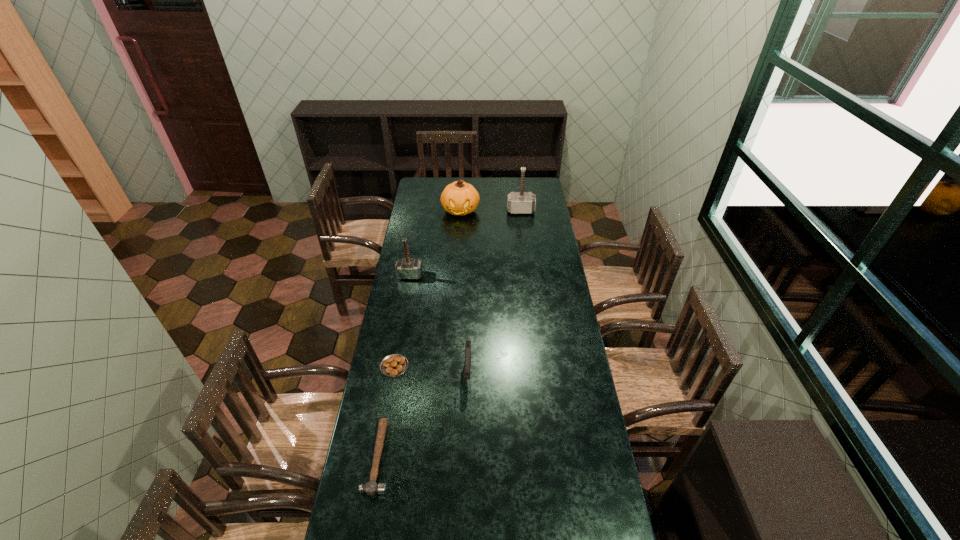
What are the coordinates of `the rightmost hammer` in the screenshot? It's located at (521, 202).

The height and width of the screenshot is (540, 960). Find the location of `the farthest hammer`. the farthest hammer is located at coordinates (521, 202).

The height and width of the screenshot is (540, 960). Find the location of `the third farthest object`. the third farthest object is located at coordinates (406, 268).

Where is `the second shortest hammer`? the second shortest hammer is located at coordinates (x=406, y=268).

Find the location of a particular element. This screenshot has width=960, height=540. pumpkin is located at coordinates (458, 198).

You are a GUI agent. You are given a task and a screenshot of the screen. Output one action in this format:
    pyautogui.click(x=<x>, y=<y>)
    Task: Click on the fourth tallest object
    Image resolution: width=960 pixels, height=540 pixels.
    Given the screenshot: What is the action you would take?
    pyautogui.click(x=467, y=343)

Image resolution: width=960 pixels, height=540 pixels. What are the coordinates of `the nearest hammer` in the screenshot? It's located at (370, 488).

Identify the location of the nearest object. The height and width of the screenshot is (540, 960). (370, 488).

The width and height of the screenshot is (960, 540). Find the location of `pastry`. pastry is located at coordinates (393, 365).

Locate an element on the screen. The image size is (960, 540). vacant area situated for striking with the head of the farthest hammer is located at coordinates (522, 220).